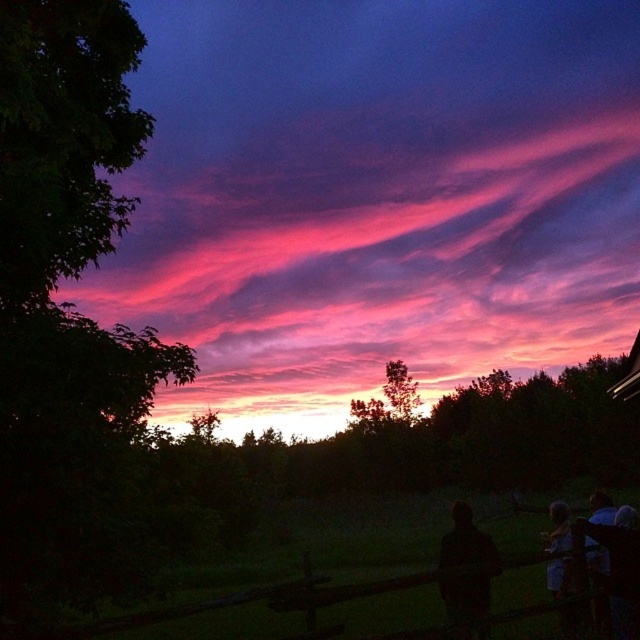
You are a photographer trying to capture the sunset scene. You notice the black matte person at lower right and the dark hair at lower right in your frame. Which object should you focus on to ensure it appears more prominent in the photo?

The black matte person at lower right should be focused on because it has a larger size compared to the dark hair at lower right, making it more prominent in the photo.

You are a photographer trying to capture the sunset. You notice the black matte person at lower right and the pink translucent clouds at upper center in your viewfinder. Which object is closer to you, the photographer?

The black matte person at lower right is closer to you because they are positioned behind the pink translucent clouds at upper center, meaning the person is in front of the clouds from your perspective.